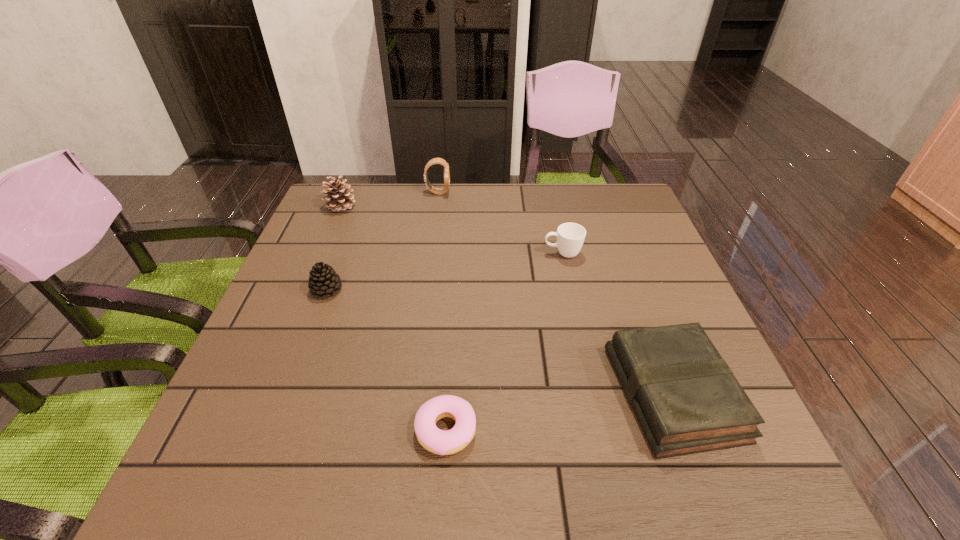
Find the location of a particular element. This screenshot has height=540, width=960. the farthest object is located at coordinates (441, 161).

Locate an element on the screen. the farther pinecone is located at coordinates (338, 192).

Identify the location of the taller pinecone. (338, 192).

Find the location of `the fourth farthest object`. the fourth farthest object is located at coordinates (323, 280).

Locate an element on the screen. Image resolution: width=960 pixels, height=540 pixels. the nearer pinecone is located at coordinates (323, 280).

Locate an element on the screen. Image resolution: width=960 pixels, height=540 pixels. the third farthest object is located at coordinates (570, 236).

Locate an element on the screen. book is located at coordinates (686, 399).

Image resolution: width=960 pixels, height=540 pixels. What are the coordinates of `the shortest object` in the screenshot? It's located at (437, 441).

The height and width of the screenshot is (540, 960). Find the location of `vacant area situated on the face of the farthest object`. vacant area situated on the face of the farthest object is located at coordinates (479, 192).

This screenshot has height=540, width=960. Identify the location of vacant space located on the front of the fifth nearest object. (328, 236).